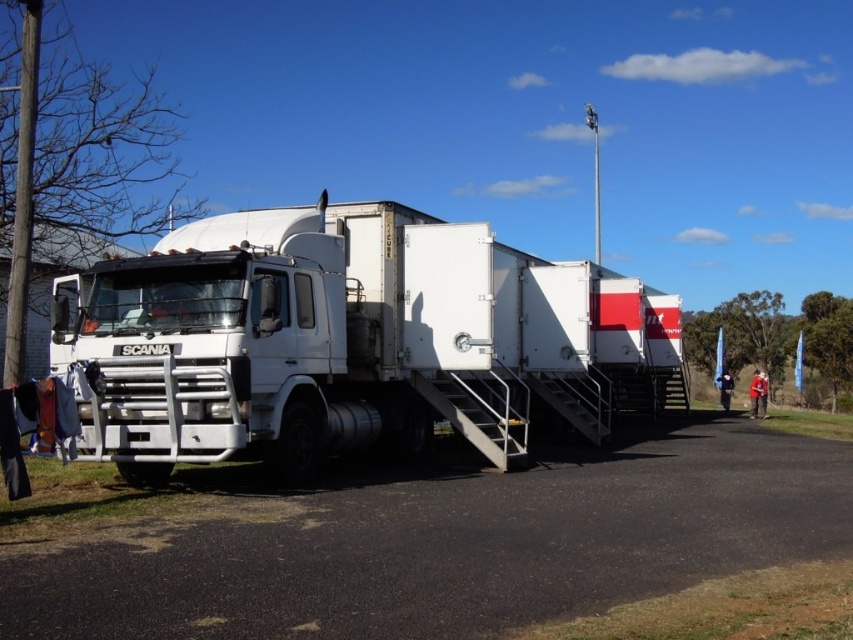
You are a delivery driver who needs to park your truck exactly 4 meters away from the black asphalt at lower center. Can you park the white matte trailer truck at center at the correct distance?

The white matte trailer truck at center is currently 3.91 meters away from the black asphalt at lower center, which is just slightly less than the required 4 meters. To park it exactly 4 meters away, you would need to move it back by approximately 0.09 meters.

You are a delivery driver who needs to park your white matte trailer truck at center under a bridge that has a height restriction of 4 meters. You observe the black asphalt at lower center where you plan to park. Can you determine if the truck will fit under the bridge based on the height comparison provided?

The white matte trailer truck at center has a greater height compared to the black asphalt at lower center. However, the height of the asphalt itself doesn not indicate the bridge height. Without knowing the bridge height relative to the asphalt, we cannot confirm if the truck will fit.